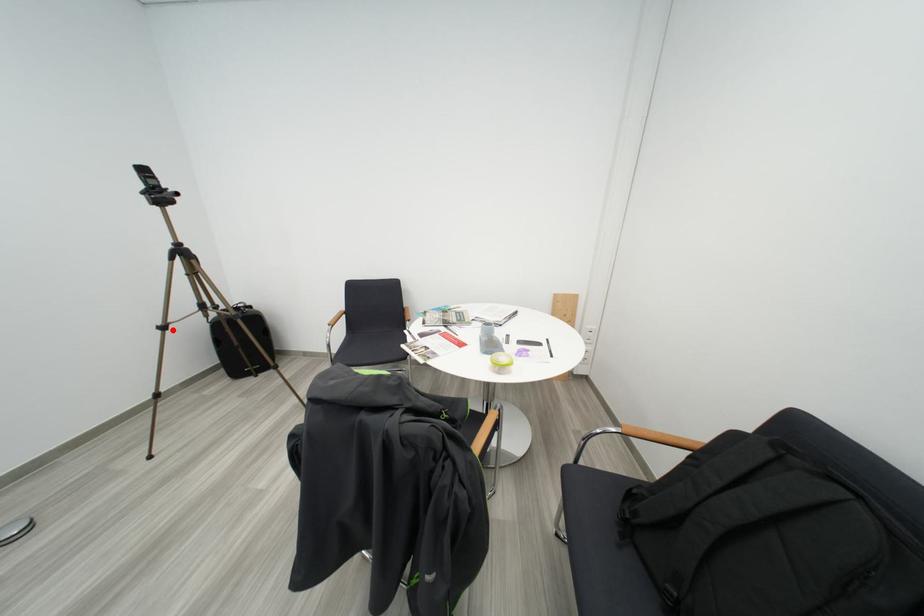
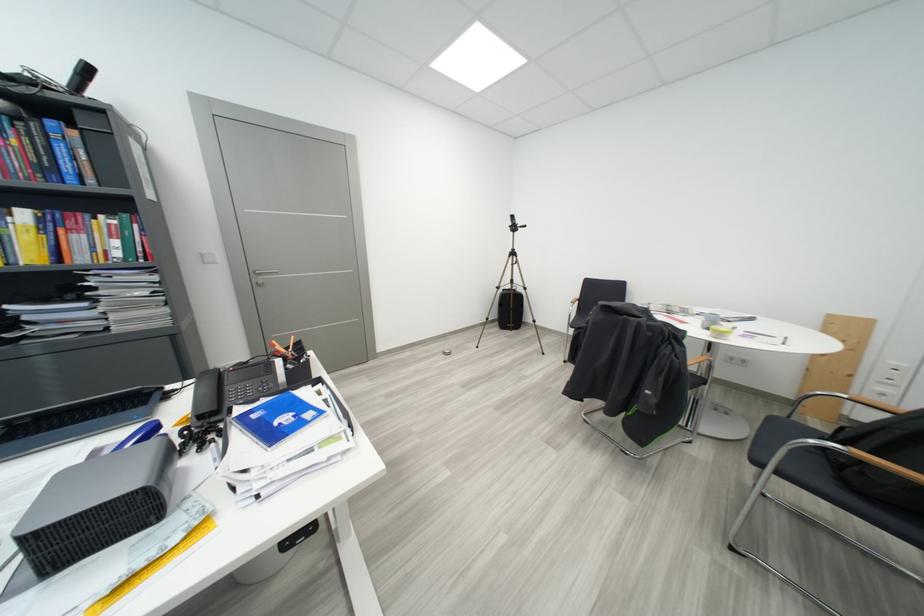
Where in the second image is the point corresponding to the highlighted location from the first image?

(506, 291)